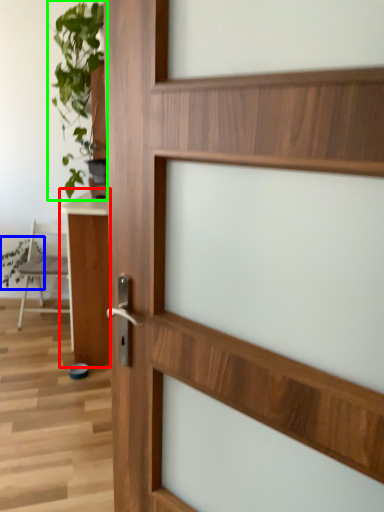
Question: Which object is the farthest from table (highlighted by a red box)? Choose among these: plant (highlighted by a blue box) or houseplant (highlighted by a green box).

Choices:
 (A) plant
 (B) houseplant

Answer: (A)